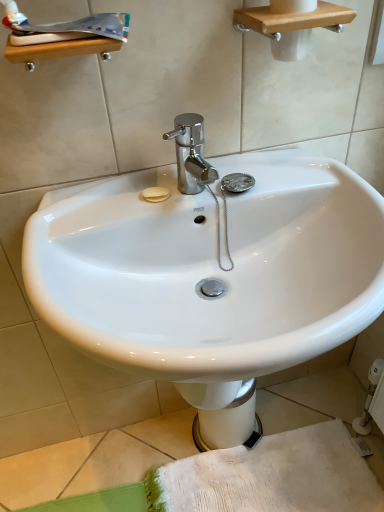
This screenshot has height=512, width=384. In order to click on vacant space in front of white glossy bidet at center in this screenshot , I will do `click(227, 489)`.